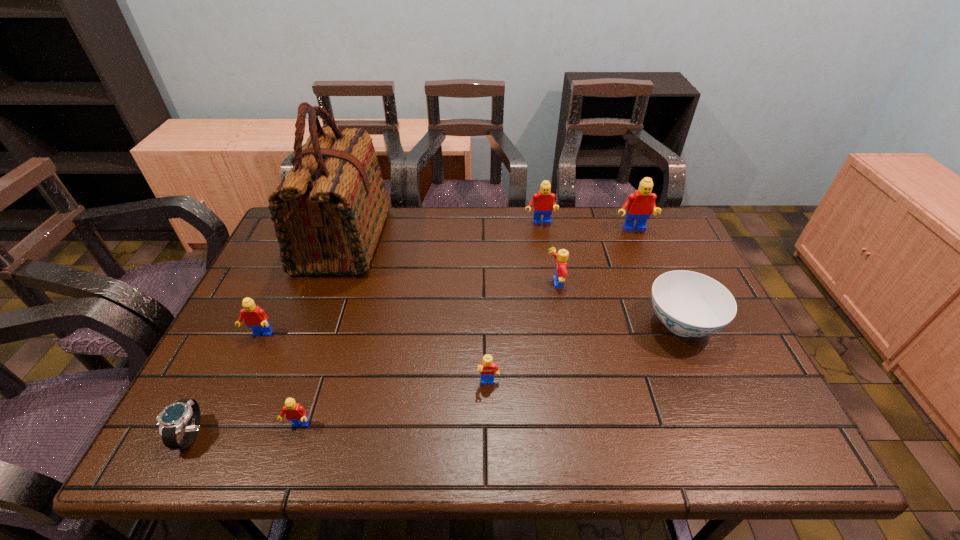
Find the location of a particular element. free region located 0.310m on the face of the right yellow Lego is located at coordinates (436, 284).

Identify the location of free space located on the front-facing side of the second smallest red Lego. The width and height of the screenshot is (960, 540). (236, 387).

The image size is (960, 540). Find the location of `vacant area situated 0.340m on the back of the chinaware`. vacant area situated 0.340m on the back of the chinaware is located at coordinates (637, 223).

You are a GUI agent. You are given a task and a screenshot of the screen. Output one action in this format:
    pyautogui.click(x=<x>, y=<y>)
    Task: Click on the vacant space located 0.110m on the face of the fourth Lego from right to left
    The width and height of the screenshot is (960, 540).
    Given the screenshot: What is the action you would take?
    pyautogui.click(x=489, y=437)

Locate an element on the screen. This screenshot has width=960, height=540. vacant region located on the back of the silver watch is located at coordinates (249, 319).

At what (x,y) coordinates should I click in order to perform the action: click on shopping bag present at the far edge. Please return your answer as a coordinate pair (x, y). Looking at the image, I should click on (328, 212).

Locate an element on the screen. Lego present at the near edge is located at coordinates (296, 413).

Find the location of a particular element. Image resolution: width=960 pixels, height=540 pixels. watch that is at the near edge is located at coordinates tap(171, 420).

At what (x,y) coordinates should I click in order to perform the action: click on shopping bag that is at the left edge. Please return your answer as a coordinate pair (x, y). The image size is (960, 540). Looking at the image, I should click on (328, 212).

The width and height of the screenshot is (960, 540). I want to click on Lego that is at the left edge, so click(254, 317).